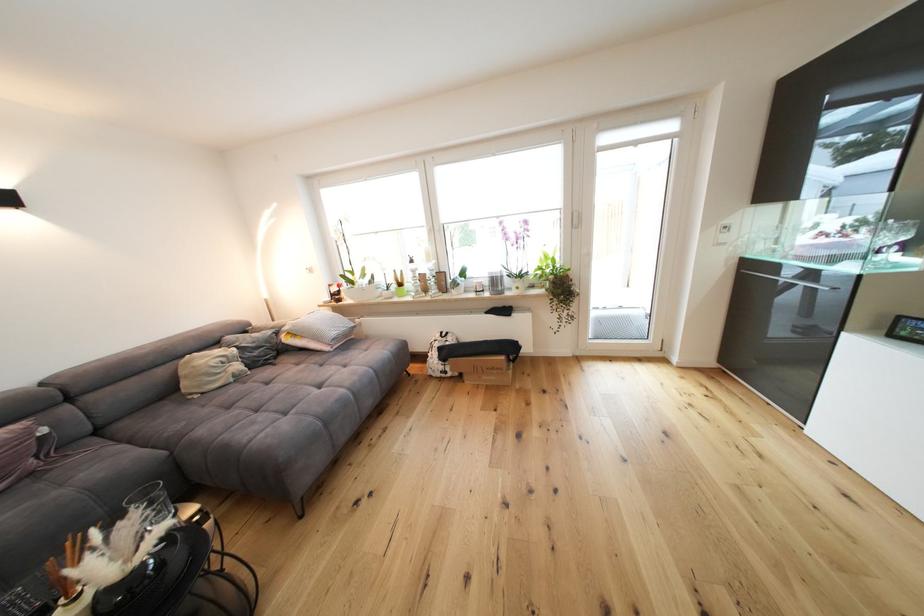
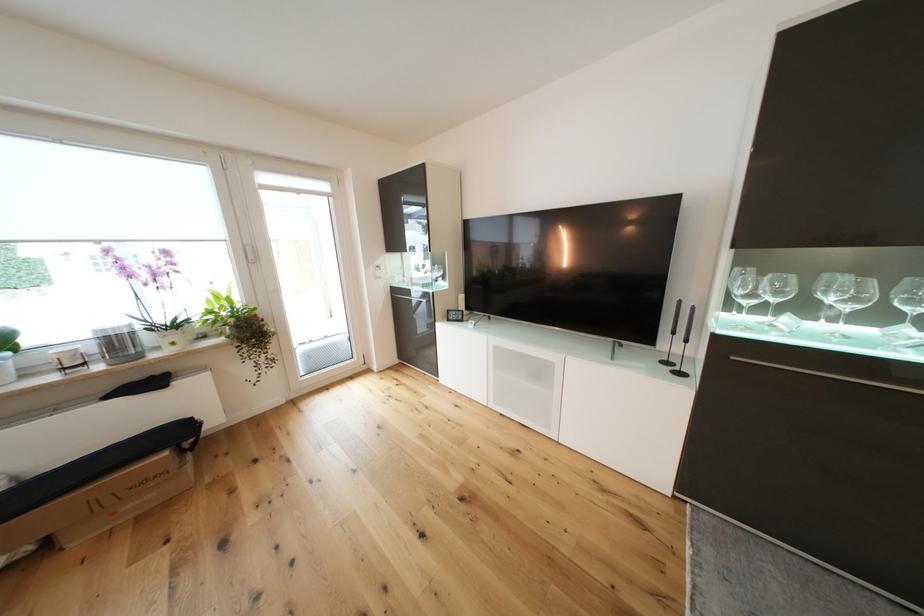
Where in the second image is the point corresponding to the point at 525,290 from the first image?

(180, 345)